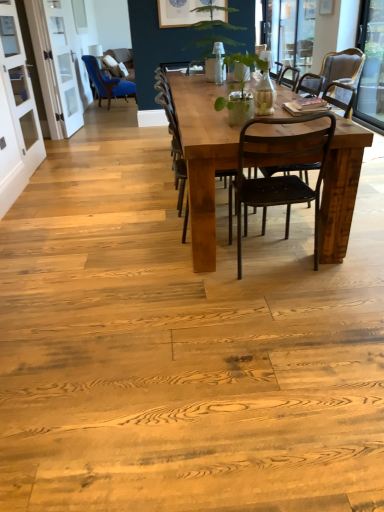
Question: From a real-world perspective, is matte black chair at center, the second chair when ordered from right to left, physically located above or below rustic wood chair at center, the fourth chair viewed from the right?

Choices:
 (A) below
 (B) above

Answer: (A)

Question: Is point (334, 82) positioned closer to the camera than point (182, 168)?

Choices:
 (A) farther
 (B) closer

Answer: (A)

Question: Which is farther from the white glass screen door at left, positioned as the first screen door in front-to-back order?

Choices:
 (A) green matte vase at center
 (B) matte black chair at center, the second chair when ordered from right to left
 (C) white glass screen door at upper left, arranged as the 2th screen door when viewed from the front
 (D) matte black chair at right, which is counted as the fourth chair, starting from the front
 (E) rustic wood table at center

Answer: (D)

Question: Estimate the real-world distances between objects in this image. Which object is farther from the blue velvet chair at left, the 1th chair when ordered from left to right?

Choices:
 (A) white glass screen door at upper left, positioned as the 1th screen door in back-to-front order
 (B) transparent glass window at upper right, which appears as the 2th window screen when ordered from the bottom
 (C) transparent glass window screen at right, which ranks as the first window screen in front-to-back order
 (D) matte black chair at right, the 1th chair when ordered from right to left
 (E) white glass screen door at left, positioned as the first screen door in front-to-back order

Answer: (C)